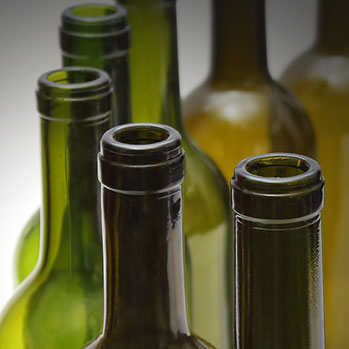
The image size is (349, 349). I want to click on bottle, so click(x=340, y=123).